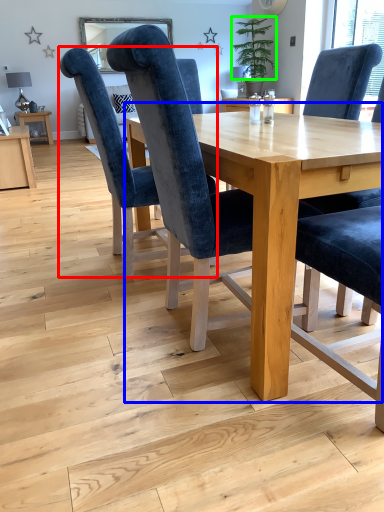
Question: Which object is positioned farthest from chair (highlighted by a red box)? Select from table (highlighted by a blue box) and plant (highlighted by a green box).

Choices:
 (A) table
 (B) plant

Answer: (B)